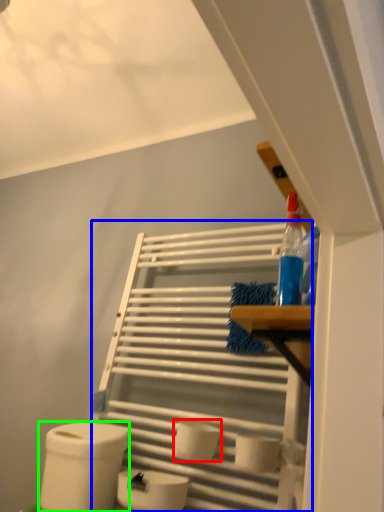
Question: Based on their relative distances, which object is nearer to toilet paper (highlighted by a red box)? Choose from shelf (highlighted by a blue box) and toilet paper (highlighted by a green box).

Choices:
 (A) shelf
 (B) toilet paper

Answer: (B)